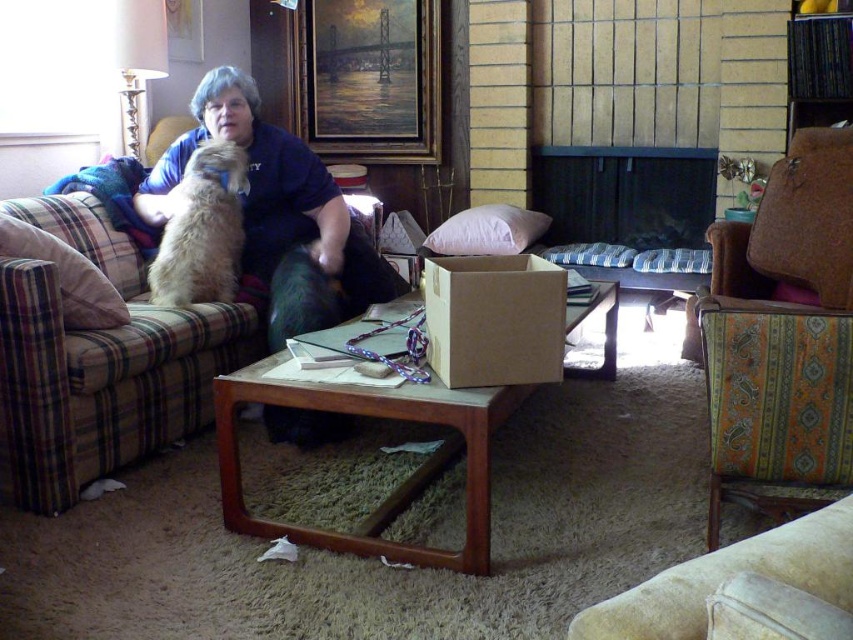
You are a guest entering the living room and want to sit down on either the plaid fabric couch at left or the fuzzy beige dog at upper left. Which one is taller and more suitable for sitting?

The plaid fabric couch at left is much taller than the fuzzy beige dog at upper left, so it is more suitable for sitting.

You are organizing items in the living room and need to place the brown cardboard box at center and the plaid fabric pillow at left. According to the scene, where should each item be positioned relative to each other?

The brown cardboard box at center should be placed to the right of the plaid fabric pillow at left, as described in the scene.

You are organizing the living room and need to decide whether to place a new decorative item on the brown cardboard box at center or the plaid fabric pillow at left. Which surface can accommodate a larger item?

The brown cardboard box at center is larger in size than the plaid fabric pillow at left, so it can accommodate a larger decorative item.